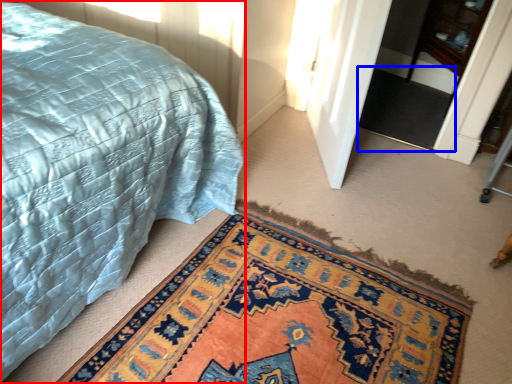
Question: Which point is closer to the camera, bed (highlighted by a red box) or doormat (highlighted by a blue box)?

Choices:
 (A) bed
 (B) doormat

Answer: (A)